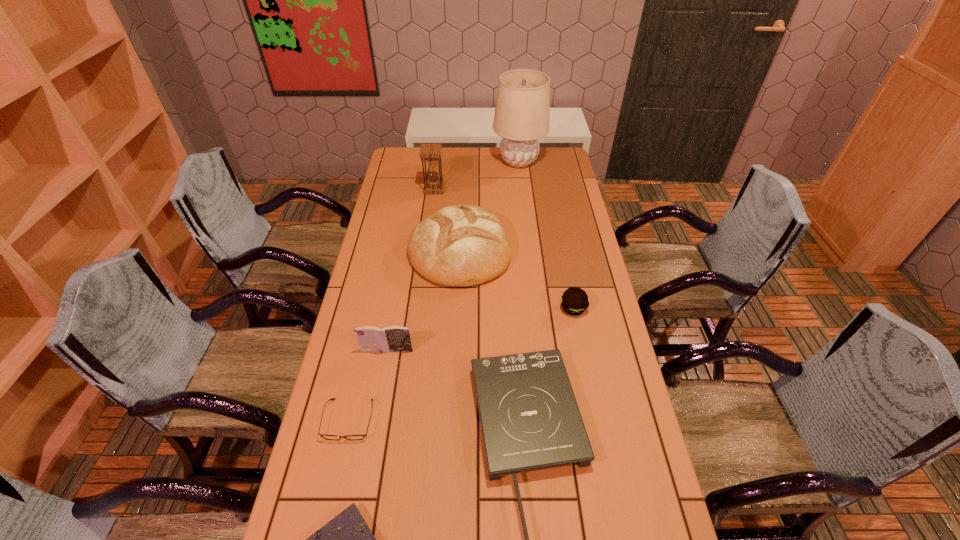
Find the location of a particular element. The height and width of the screenshot is (540, 960). patty situated at the right edge is located at coordinates (574, 301).

This screenshot has width=960, height=540. I want to click on object at the far right corner, so click(522, 114).

In the image, there is a desktop. Where is `vacant area at the far edge`? vacant area at the far edge is located at coordinates (480, 151).

Where is `vacant space at the left edge`? The width and height of the screenshot is (960, 540). vacant space at the left edge is located at coordinates (319, 485).

The height and width of the screenshot is (540, 960). I want to click on blank space at the right edge of the desktop, so click(x=590, y=469).

Locate an element on the screen. vacant area at the far left corner is located at coordinates (409, 153).

This screenshot has width=960, height=540. Identify the location of free spot at the far right corner of the desktop. (562, 170).

What are the coordinates of `empty location between the seventh tallest object and the book` in the screenshot? It's located at (368, 385).

Find the location of `free point between the lampshade and the patty`. free point between the lampshade and the patty is located at coordinates (546, 235).

At what (x,y) coordinates should I click in order to perform the action: click on free space between the tallest object and the third farthest object. Please return your answer as a coordinate pair (x, y). Looking at the image, I should click on (490, 205).